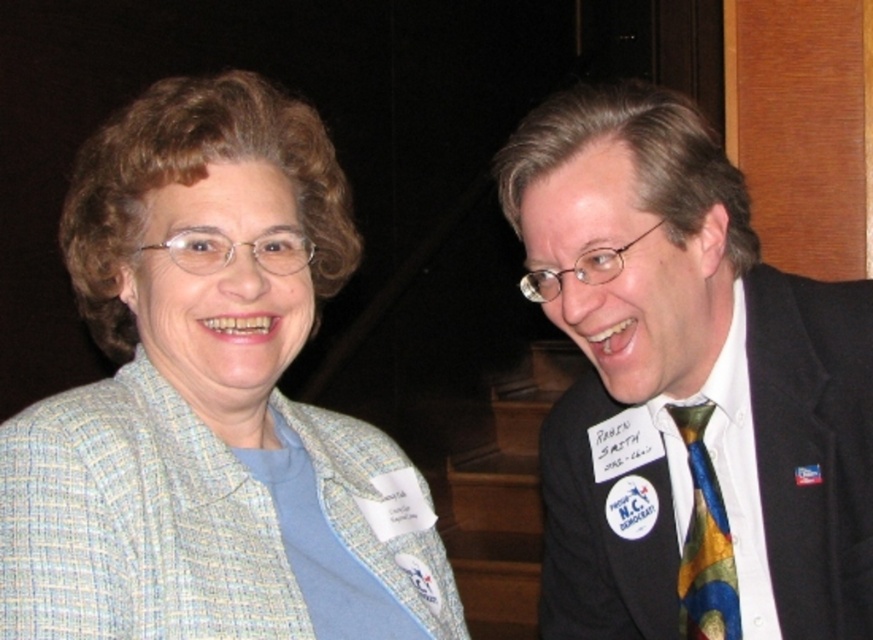
You are a photographer taking a picture of two people. You notice both the multicolored tie at right and the multicolored silk tie at right. Which one is closer to you?

The multicolored tie at right is closer to the viewer than the multicolored silk tie at right.

You are a photographer trying to capture a clear shot of the name tags on both individuals. Since the two ties are in the way, you need to adjust your angle. Which tie should you move first to ensure both name tags are visible? The multicolored tie at right or the multicolored silk tie at right?

The multicolored tie at right has a greater height compared to the multicolored silk tie at right, so you should move the multicolored tie at right first to ensure both name tags are visible.